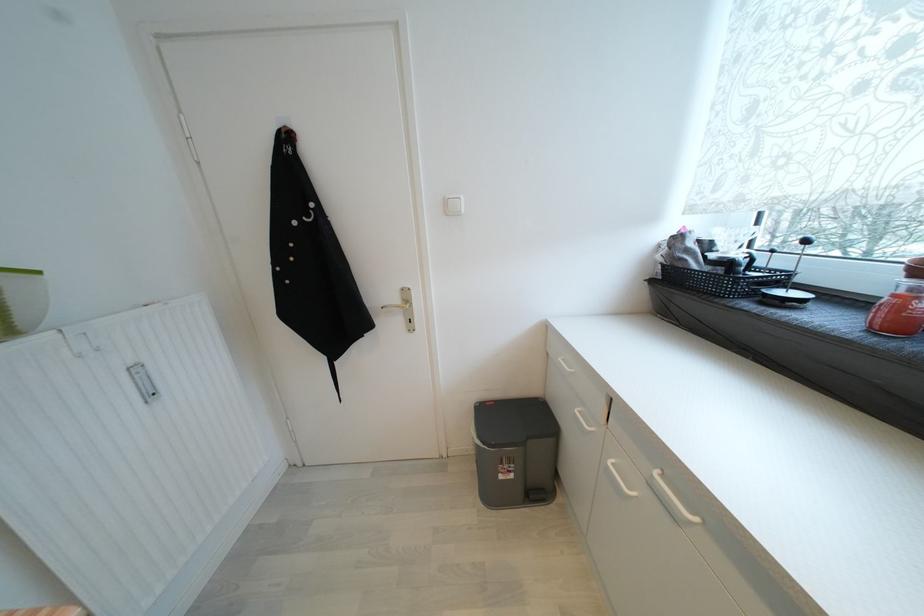
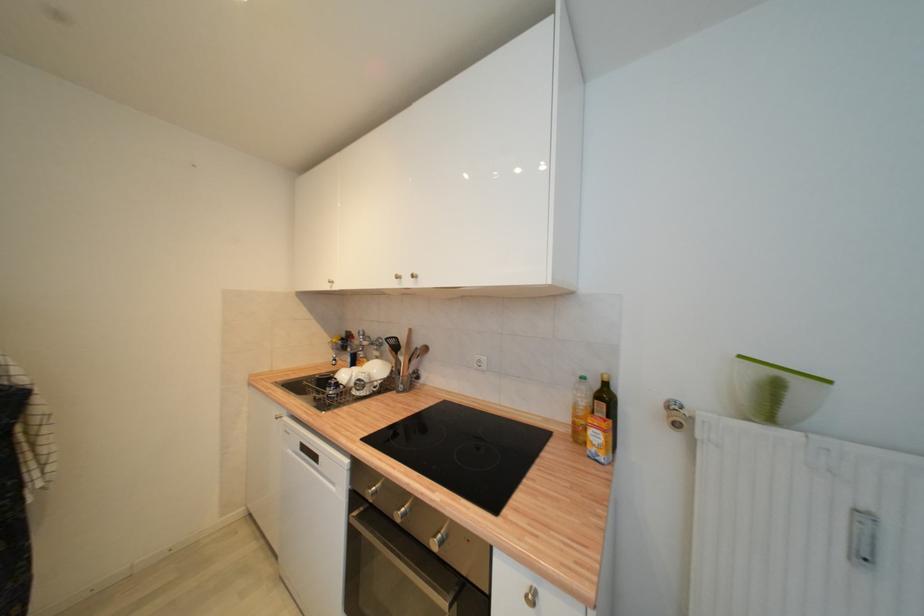
Find the pixel in the second image that matches point (156, 397) in the first image.

(869, 560)